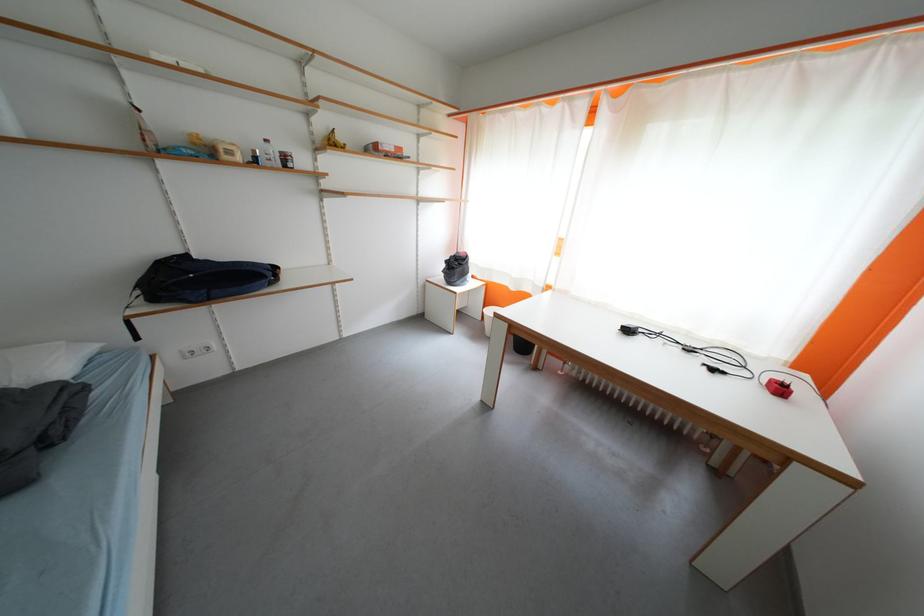
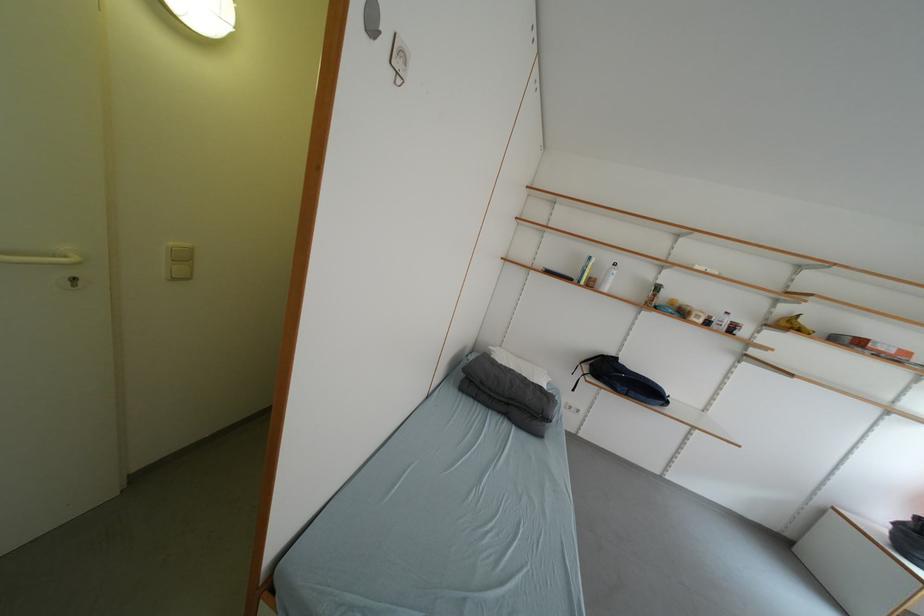
Find the pixel in the second image that matches point 339,147 in the first image.

(797, 328)